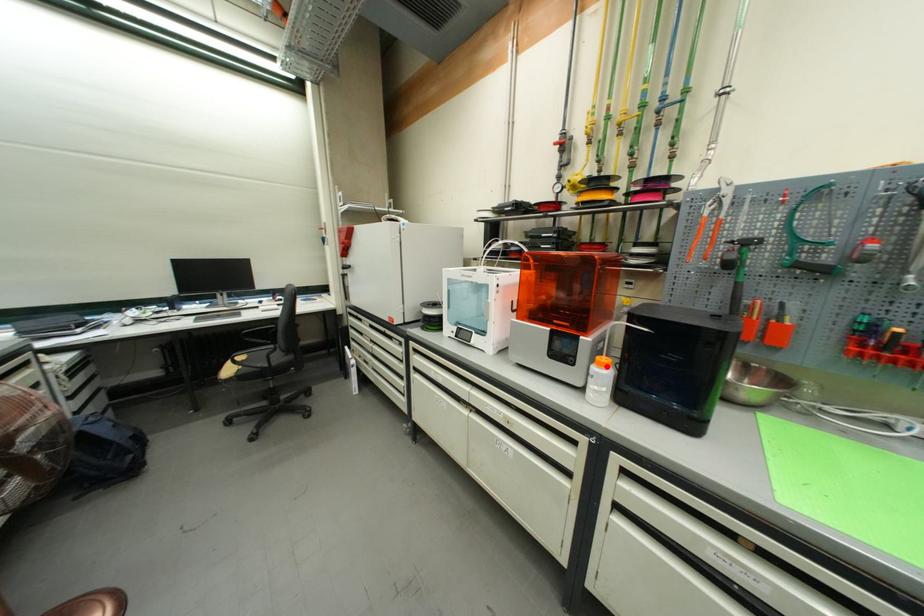
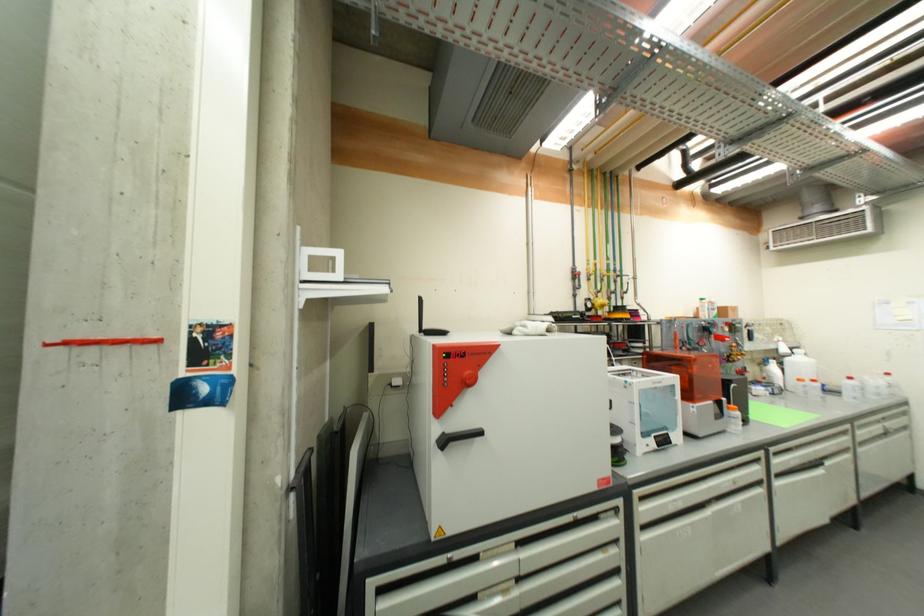
In the second image, find the point that corresponds to the highlighted location in the first image.

(739, 411)